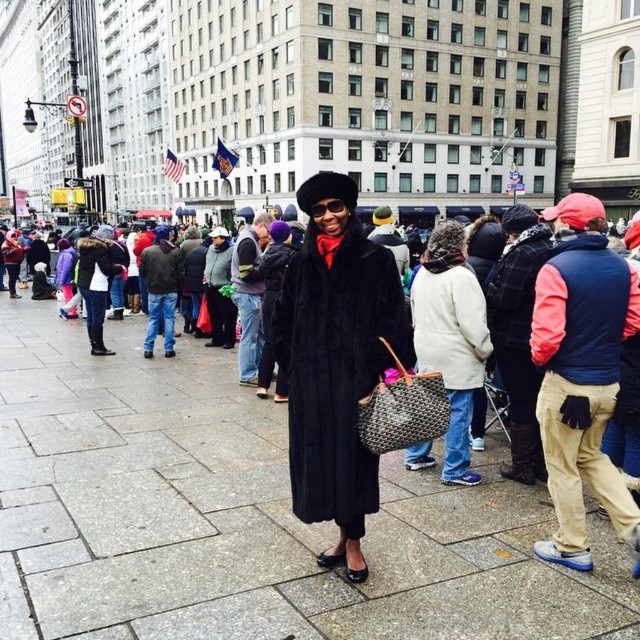
Question: Can you confirm if smooth concrete pavement at center is thinner than velvet black coat at center?

Choices:
 (A) yes
 (B) no

Answer: (B)

Question: Which point is farther from the camera taking this photo?

Choices:
 (A) (422, 273)
 (B) (280, 353)

Answer: (A)

Question: Among these objects, which one is nearest to the camera?

Choices:
 (A) smooth concrete pavement at center
 (B) white wool coat at center
 (C) velvet black coat at center

Answer: (A)

Question: Can you confirm if velvet black coat at center is positioned to the right of white wool coat at center?

Choices:
 (A) yes
 (B) no

Answer: (B)

Question: Which is farther from the smooth concrete pavement at center?

Choices:
 (A) velvet black coat at center
 (B) white wool coat at center

Answer: (B)

Question: Considering the relative positions of smooth concrete pavement at center and white wool coat at center in the image provided, where is smooth concrete pavement at center located with respect to white wool coat at center?

Choices:
 (A) below
 (B) above

Answer: (A)